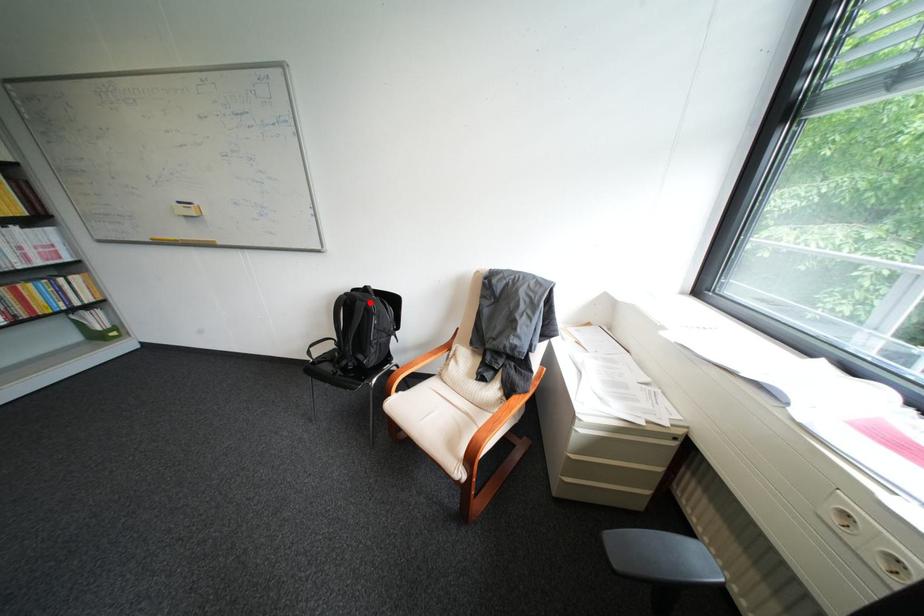
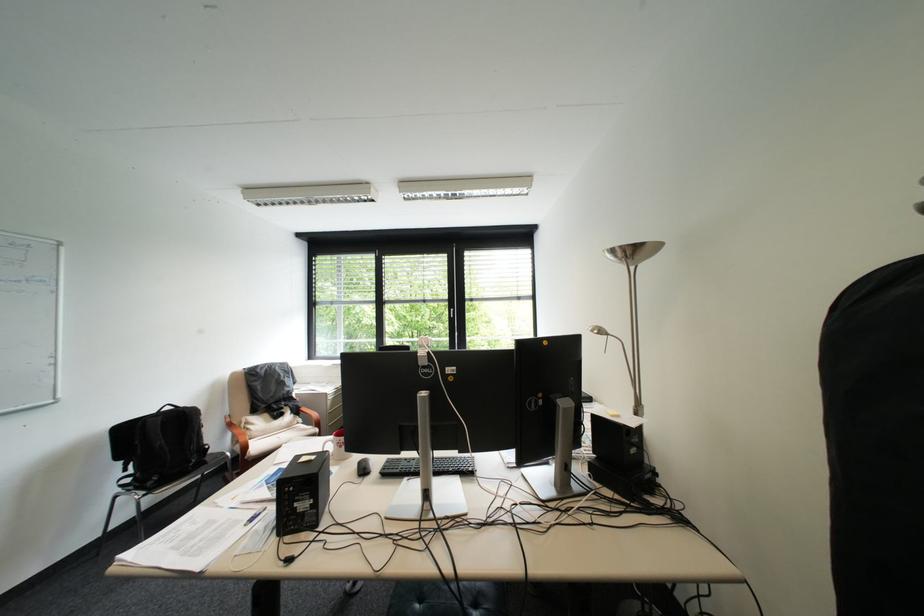
Locate, in the second image, the point that corresponds to the highlighted location in the first image.

(198, 411)